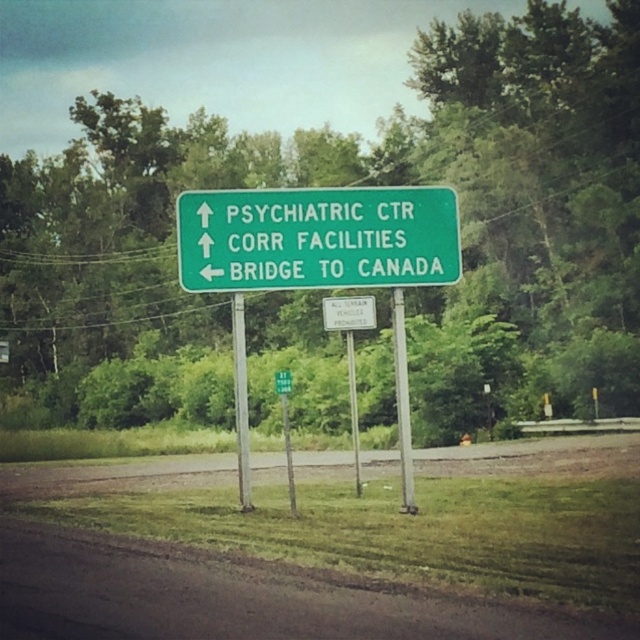
Is silver metallic pole at center positioned behind white plastic sign at center?

No.

Locate an element on the screen. The height and width of the screenshot is (640, 640). silver metallic pole at center is located at coordinates (241, 401).

Where is `silver metallic pole at center`? silver metallic pole at center is located at coordinates (241, 401).

Between green matte sign at center and green metallic pole at center, which one has less height?

green matte sign at center is shorter.

The height and width of the screenshot is (640, 640). What are the coordinates of `green matte sign at center` in the screenshot? It's located at (316, 237).

From the picture: Which is below, green metallic pole at center or silver metallic pole at center?

green metallic pole at center

What do you see at coordinates (403, 403) in the screenshot? This screenshot has height=640, width=640. I see `green metallic pole at center` at bounding box center [403, 403].

Who is more forward, (404,428) or (236,339)?

Positioned in front is point (404,428).

Where is `green metallic pole at center`? green metallic pole at center is located at coordinates (403, 403).